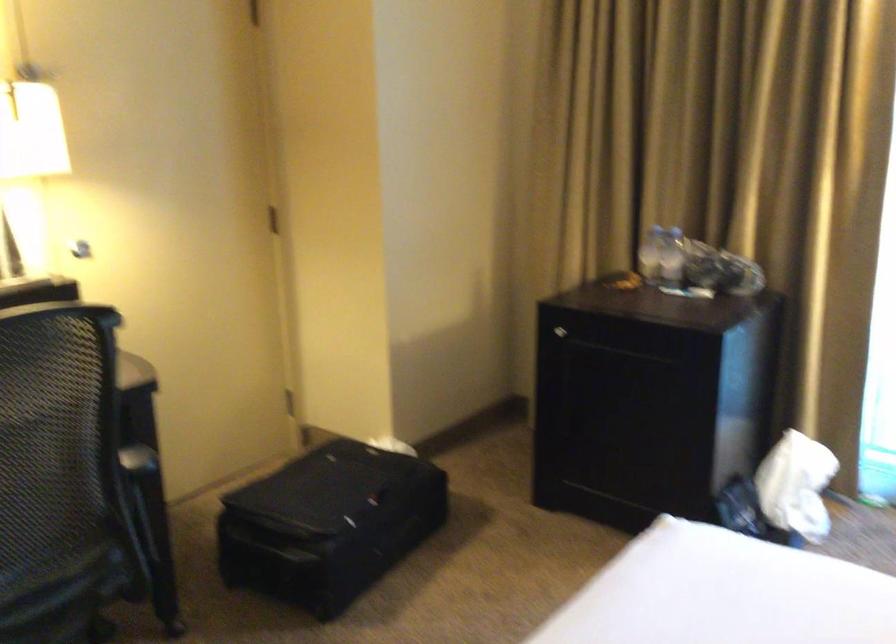
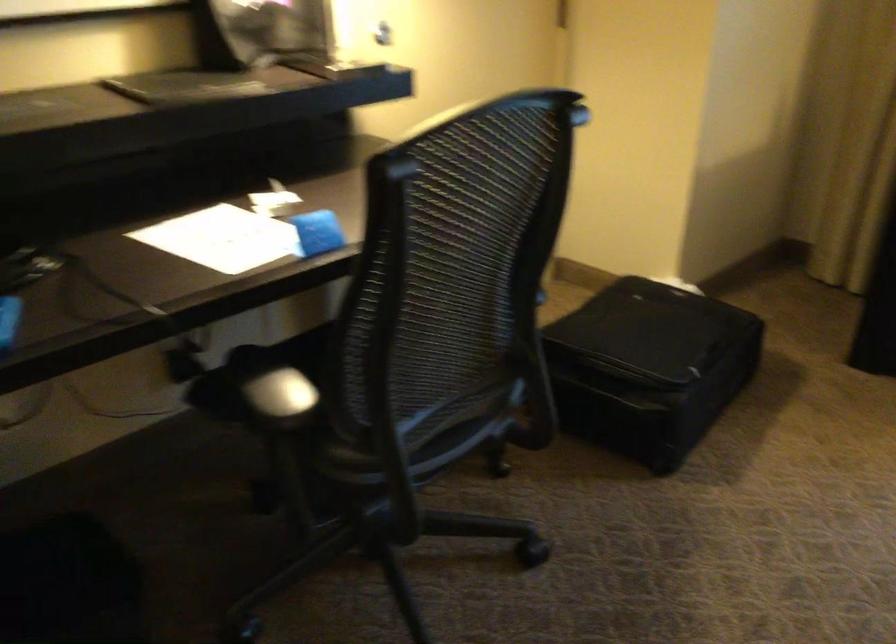
The point at (311, 524) is marked in the first image. Where is the corresponding point in the second image?

(649, 366)